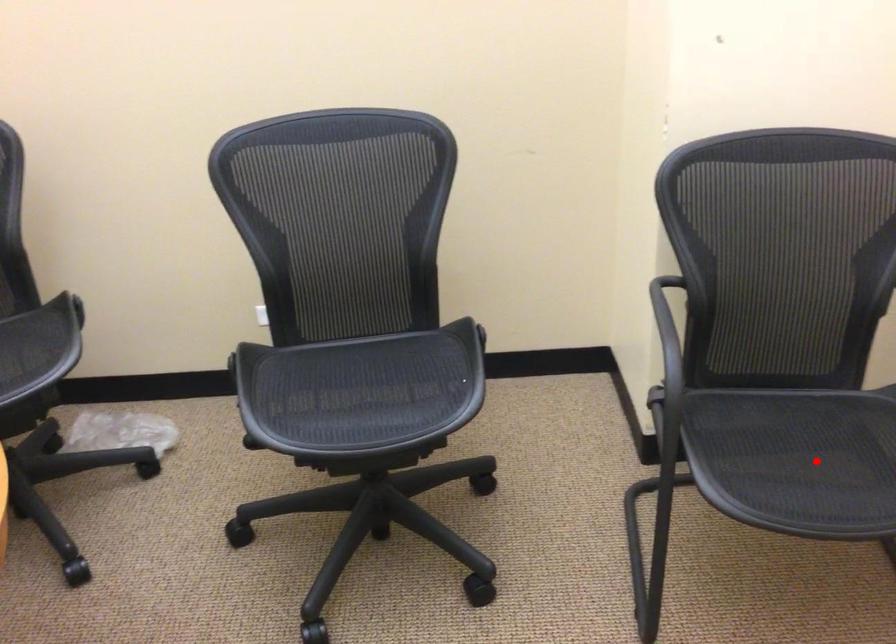
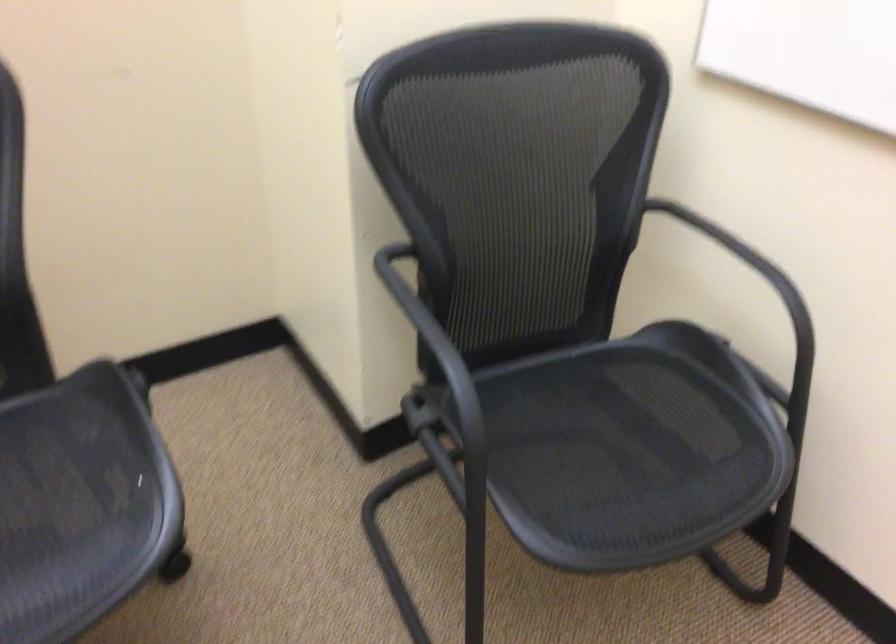
Question: I am providing you with two images of the same scene from different viewpoints. A red point is shown in image1. For the corresponding object point in image2, is it positioned nearer or farther from the camera?

Choices:
 (A) Nearer
 (B) Farther

Answer: (A)